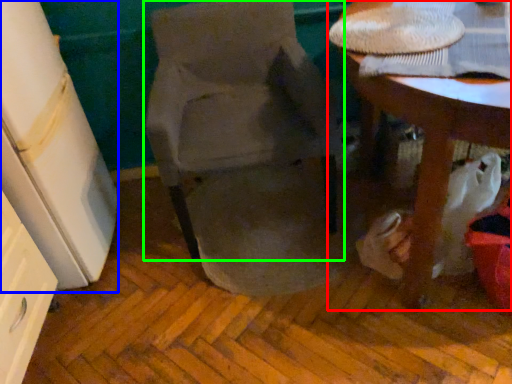
Question: Based on their relative distances, which object is farther from table (highlighted by a red box)? Choose from leftover (highlighted by a blue box) and chair (highlighted by a green box).

Choices:
 (A) leftover
 (B) chair

Answer: (A)